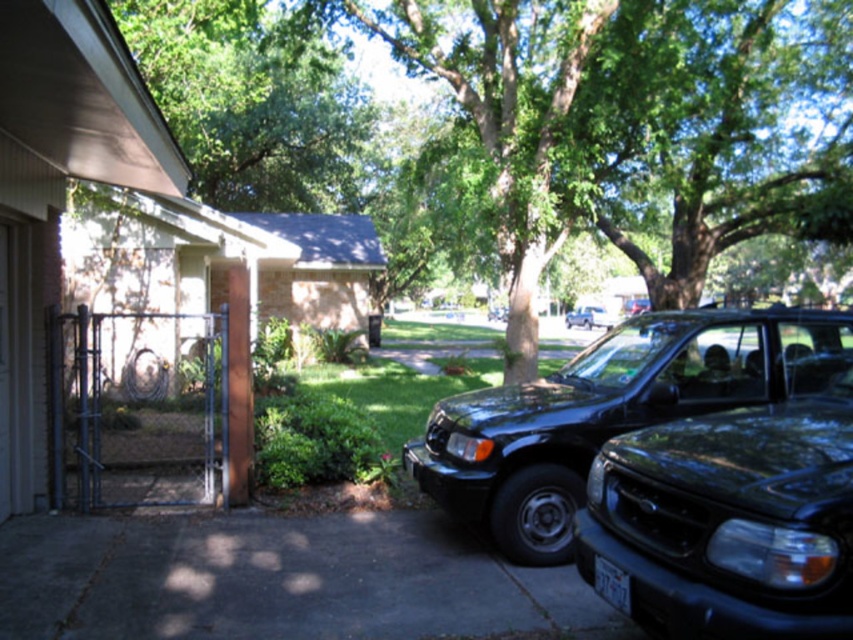
Does gray concrete pavement at lower center appear on the right side of glossy black suv at center?

In fact, gray concrete pavement at lower center is to the left of glossy black suv at center.

Who is lower down, gray concrete pavement at lower center or glossy black suv at center?

gray concrete pavement at lower center is below.

Measure the distance between gray concrete pavement at lower center and camera.

gray concrete pavement at lower center and camera are 13.25 feet apart.

Identify the location of gray concrete pavement at lower center. click(x=277, y=580).

Between gray concrete pavement at lower center and black glossy suv at center, which one appears on the right side from the viewer's perspective?

black glossy suv at center is more to the right.

Find the location of a particular element. gray concrete pavement at lower center is located at coordinates (277, 580).

Is glossy black suv at center positioned before shiny black suv at center?

Yes, glossy black suv at center is in front of shiny black suv at center.

Looking at this image, can you confirm if glossy black suv at center is shorter than shiny black suv at center?

Yes.

Is point (653, 376) in front of point (578, 324)?

Yes, point (653, 376) is closer to viewer.

The width and height of the screenshot is (853, 640). Find the location of `glossy black suv at center`. glossy black suv at center is located at coordinates (610, 412).